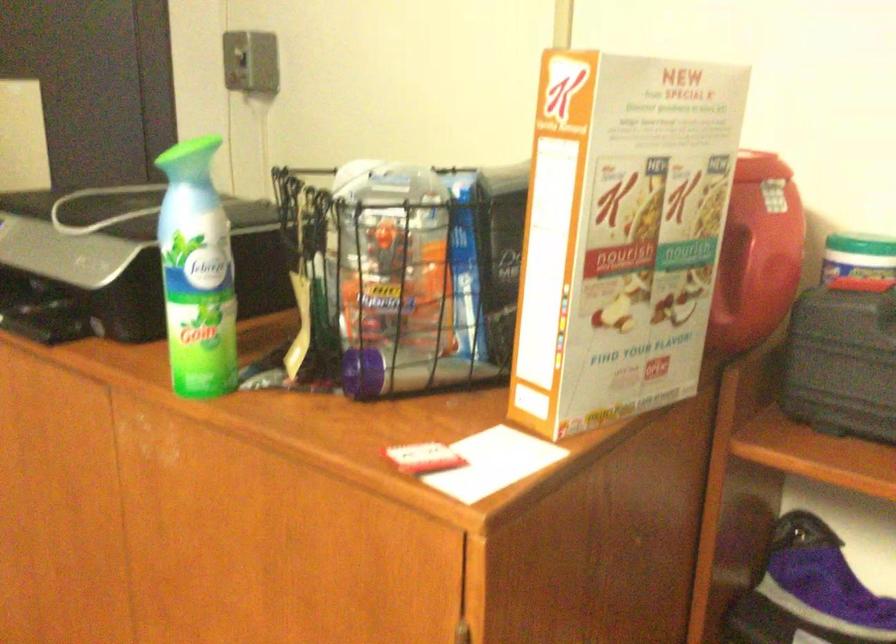
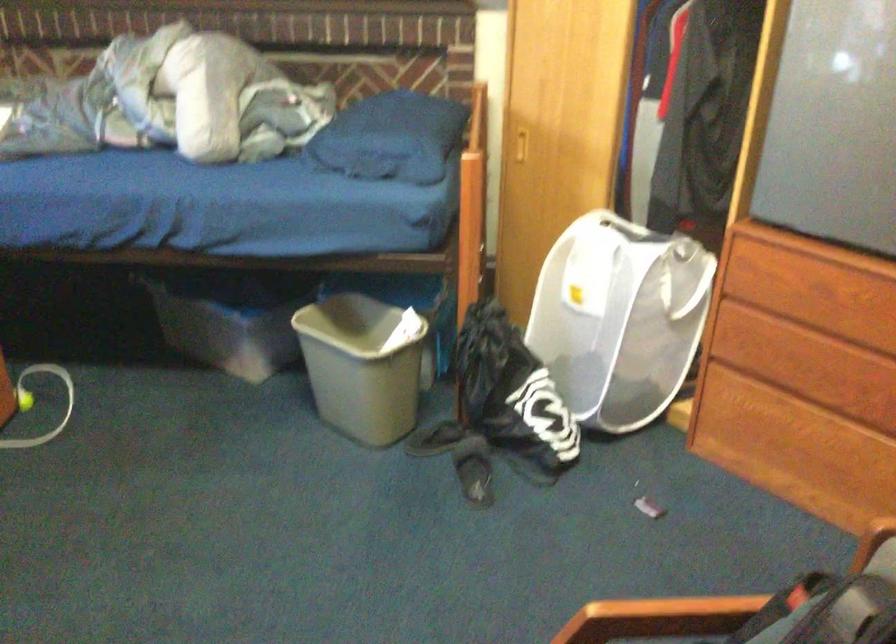
Based on the continuous images, in which direction is the camera rotating?

The camera's rotation is toward left-down.